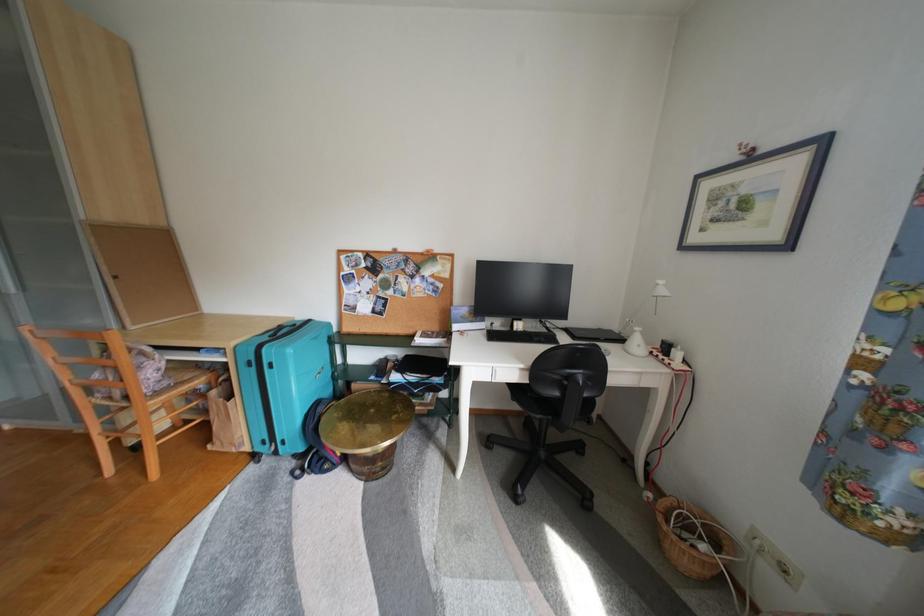
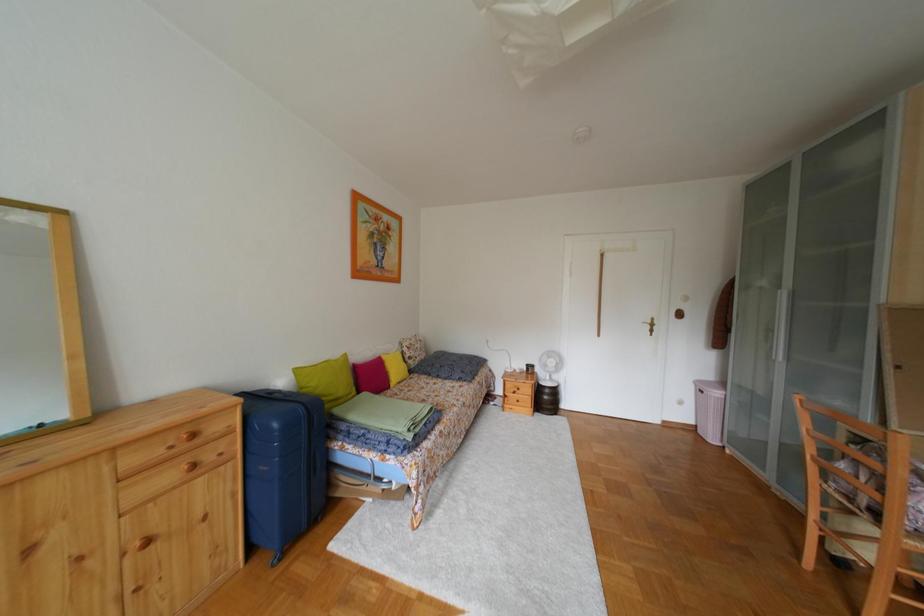
Question: The camera is either moving clockwise (left) or counter-clockwise (right) around the object. The first image is from the beginning of the video and the second image is from the end. Is the camera moving left or right when shooting the video?

Choices:
 (A) Left
 (B) Right

Answer: (B)